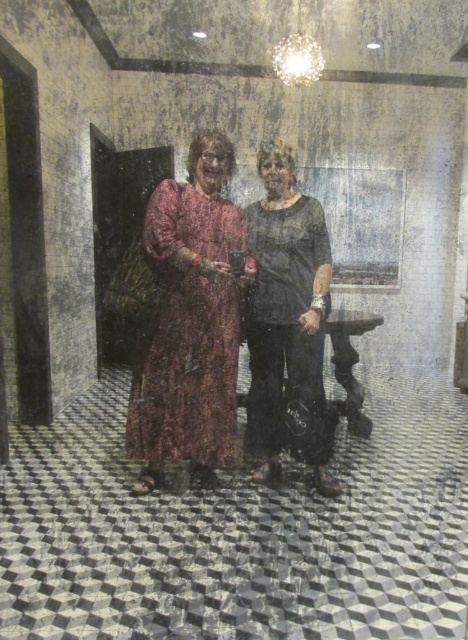
Based on the photo, can you confirm if floral-patterned fabric dress at center is bigger than matte black shirt at center?

Yes, floral-patterned fabric dress at center is bigger than matte black shirt at center.

Can you confirm if floral-patterned fabric dress at center is shorter than matte black shirt at center?

Indeed, floral-patterned fabric dress at center has a lesser height compared to matte black shirt at center.

Which is behind, point (221, 356) or point (260, 397)?

The point (260, 397) is behind.

In order to click on floral-patterned fabric dress at center in this screenshot , I will do `click(188, 332)`.

Is patterned fabric dress at center further to the viewer compared to matte black shirt at center?

That is False.

Who is shorter, patterned fabric dress at center or matte black shirt at center?

With less height is matte black shirt at center.

Does point (213, 337) come behind point (313, 304)?

Yes, point (213, 337) is farther from viewer.

This screenshot has width=468, height=640. In order to click on patterned fabric dress at center in this screenshot , I will do (191, 321).

Between patterned fabric dress at center and floral-patterned fabric dress at center, which one appears on the left side from the viewer's perspective?

floral-patterned fabric dress at center is more to the left.

Between patterned fabric dress at center and floral-patterned fabric dress at center, which one is positioned lower?

floral-patterned fabric dress at center is below.

Find the location of a particular element. patterned fabric dress at center is located at coordinates (191, 321).